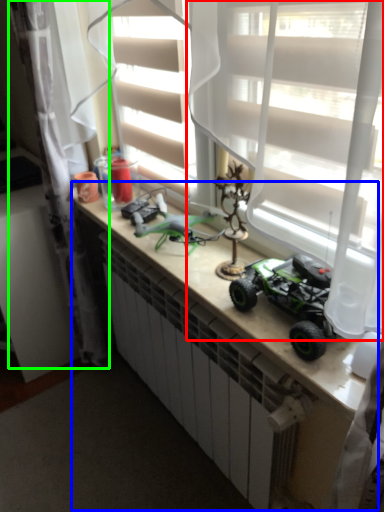
Question: Which object is positioned farthest from curtain (highlighted by a red box)? Select from counter (highlighted by a blue box) and curtain (highlighted by a green box).

Choices:
 (A) counter
 (B) curtain

Answer: (B)